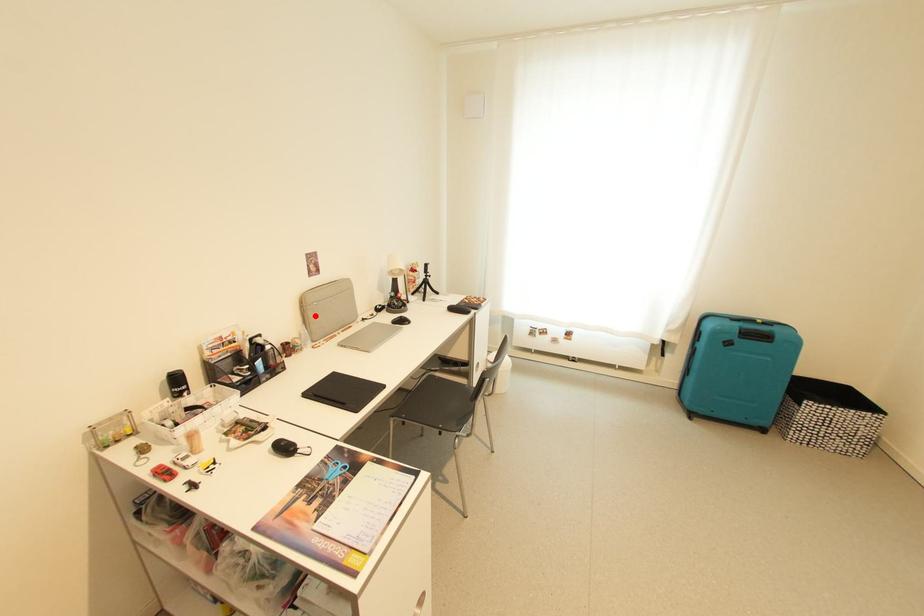
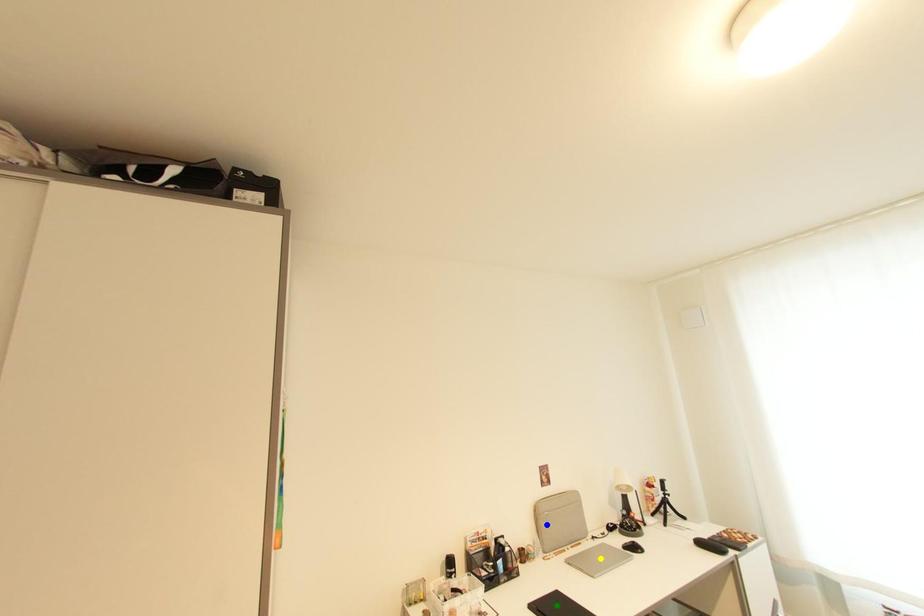
Question: I am providing you with two images of the same scene from different viewpoints. A red point is marked on the first image. You are given multiple points on the second image. Which point in image 2 is actually the same real-world point as the red point in image 1?

Choices:
 (A) green point
 (B) blue point
 (C) yellow point

Answer: (B)